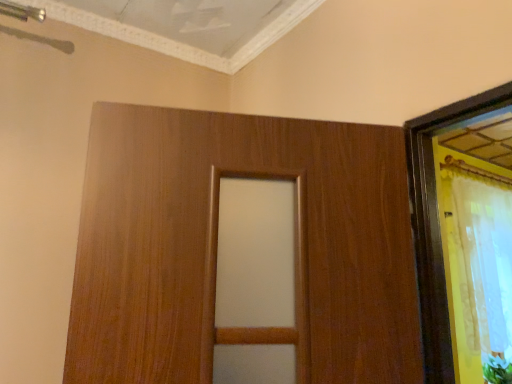
Question: From the image's perspective, is green leafy plant at lower right positioned above or below white sheer curtain at right?

Choices:
 (A) above
 (B) below

Answer: (B)

Question: Is green leafy plant at lower right in front of or behind white sheer curtain at right in the image?

Choices:
 (A) front
 (B) behind

Answer: (B)

Question: In terms of size, does green leafy plant at lower right appear bigger or smaller than white sheer curtain at right?

Choices:
 (A) small
 (B) big

Answer: (A)

Question: From a real-world perspective, relative to green leafy plant at lower right, is white sheer curtain at right vertically above or below?

Choices:
 (A) below
 (B) above

Answer: (B)

Question: Is white sheer curtain at right bigger or smaller than green leafy plant at lower right?

Choices:
 (A) small
 (B) big

Answer: (B)

Question: Considering their positions, is white sheer curtain at right located in front of or behind green leafy plant at lower right?

Choices:
 (A) front
 (B) behind

Answer: (A)

Question: Is point (485, 231) positioned closer to the camera than point (487, 364)?

Choices:
 (A) farther
 (B) closer

Answer: (A)